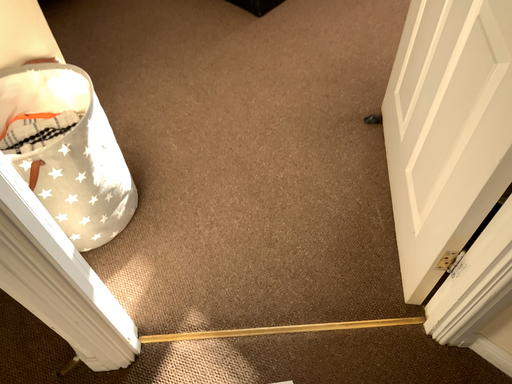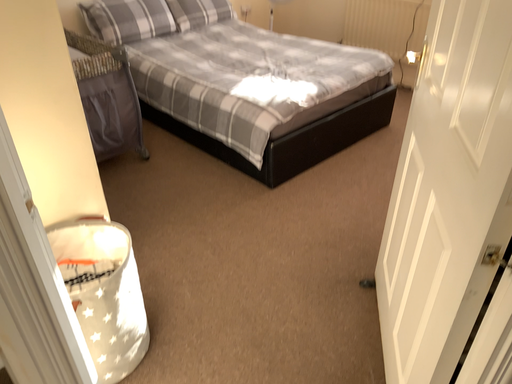
Question: Which way did the camera rotate in the video?

Choices:
 (A) rotated upward
 (B) rotated downward

Answer: (A)